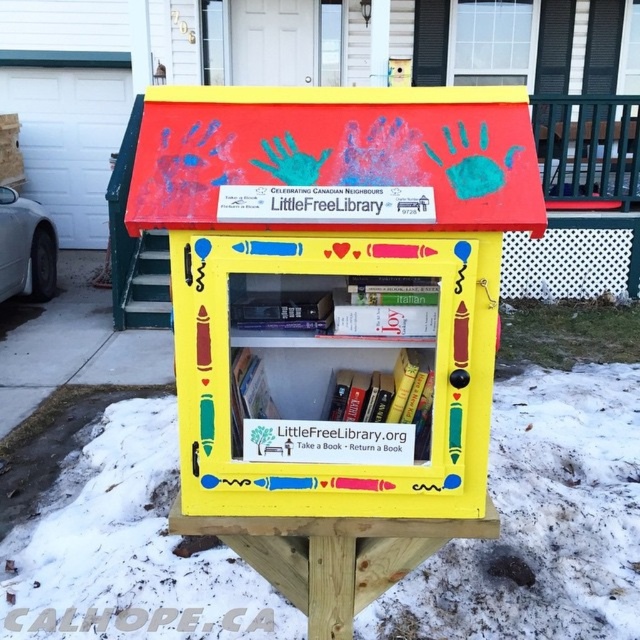
Identify the location of white powdery snow at lower center. (541, 522).

Who is more forward, (621, 497) or (376, 445)?

Point (376, 445)

The image size is (640, 640). I want to click on white powdery snow at lower center, so click(541, 522).